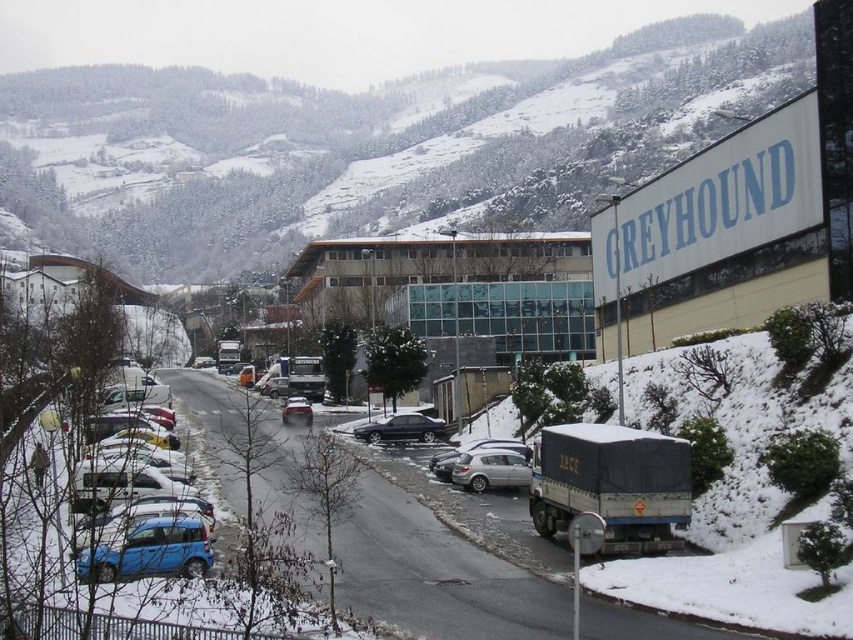
You are standing at the intersection looking at the snowy street with parked cars. There are two points marked on the image, one at point coordinates point (132, 520) and the other at point (305, 404). Which point is nearer to you?

Point (132, 520) is closer to the camera than point (305, 404), so the point at coordinates point (132, 520) is nearer to you.

You are a delivery driver who needs to park your vehicle between the matte blue hatchback at lower left and the metallic silver sedan at center. Is there enough space for your vehicle, which is 4.5 meters long, between them?

The matte blue hatchback at lower left is positioned on the right side of metallic silver sedan at center. Therefore, the space between them is likely insufficient for a 4.5 meter vehicle since the hatchback is already to the right of the sedan, implying minimal separation between the two cars.

You are a delivery person trying to navigate through the snowy street. You see the matte blue hatchback at lower left and the satin black sedan at center. Which vehicle is positioned higher up in the image?

The matte blue hatchback at lower left is located above the satin black sedan at center, so it is positioned higher up in the image.